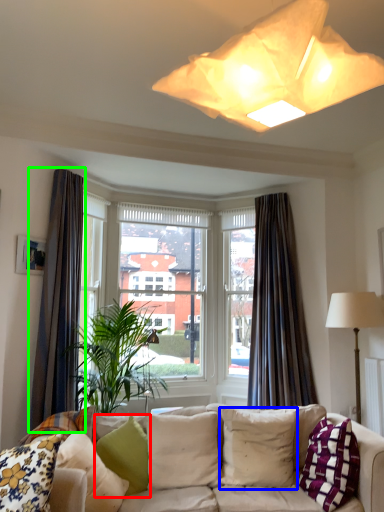
Question: Estimate the real-world distances between objects in this image. Which object is closer to pillow (highlighted by a red box), pillow (highlighted by a blue box) or curtain (highlighted by a green box)?

Choices:
 (A) pillow
 (B) curtain

Answer: (A)